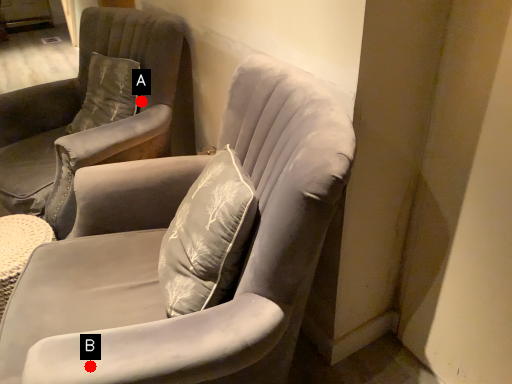
Question: Two points are circled on the image, labeled by A and B beside each circle. Among these points, which one is nearest to the camera?

Choices:
 (A) A is closer
 (B) B is closer

Answer: (B)